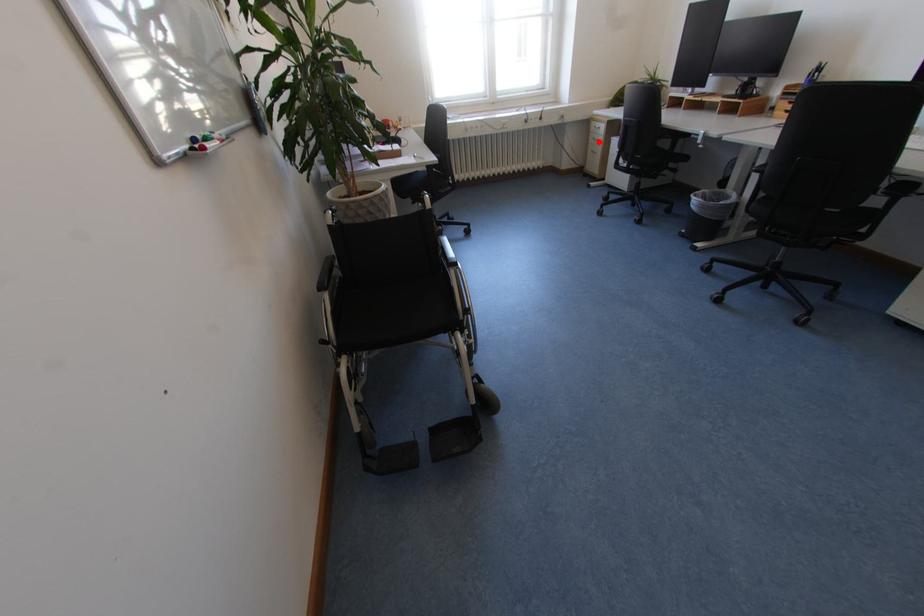
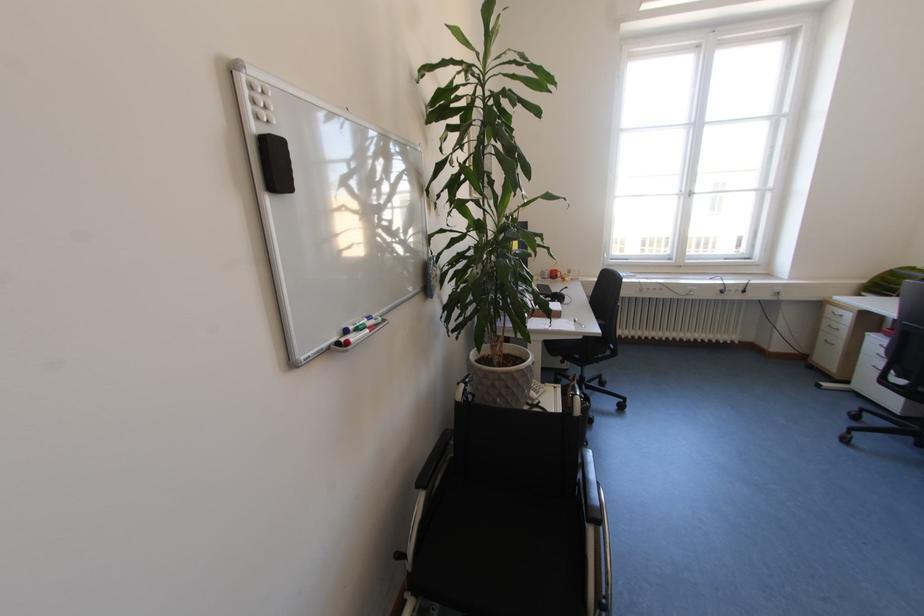
Find the pixel in the second image that matches the highlighted location in the first image.

(833, 328)